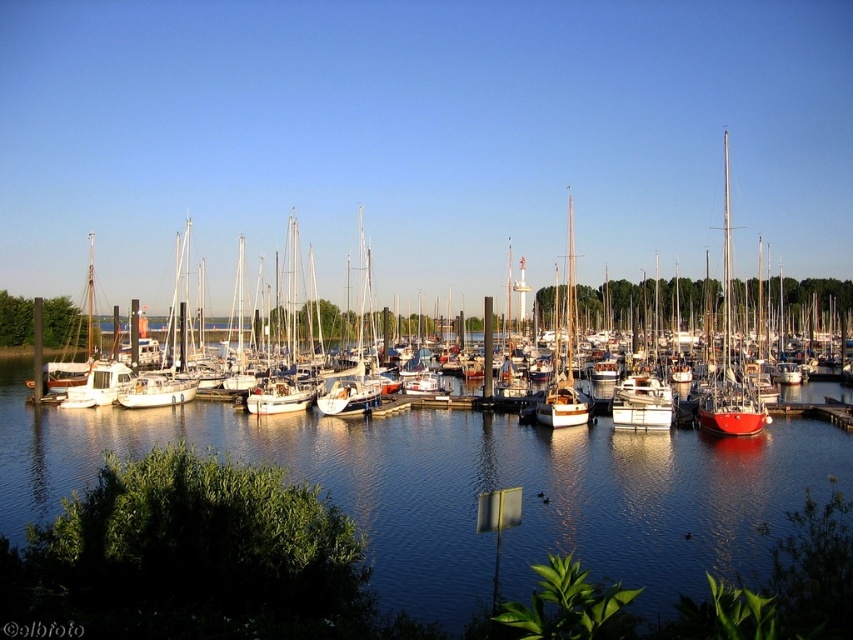
You are a photographer wanting to capture the clear blue water at center and the white matte sailboat at center in a single shot. Which object will appear smaller in the photo?

The clear blue water at center will appear smaller in the photo because it is described as being smaller than the white matte sailboat at center.

You are standing at the edge of the marina and see the point labeled as point (x=467, y=490). Based on the scene description, can you determine what surface this point is located on?

The point (x=467, y=490) is on clear blue water at center according to the description, so it is located on the water surface.

You are standing at the edge of the marina and see two points marked on the water surface. The first point is at coordinate point (627, 586) and the second is at point (196, 381). If you want to throw a small floating object towards the second point, will it pass in front of the first point?

Point (627, 586) is in front of point (196, 381), so throwing the object towards the second point would require passing behind the first point, meaning it won